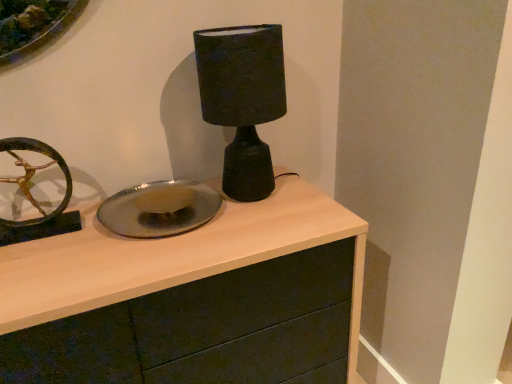
This screenshot has height=384, width=512. Identify the location of vacant area located to the right-hand side of shiny metallic plate at center. (268, 215).